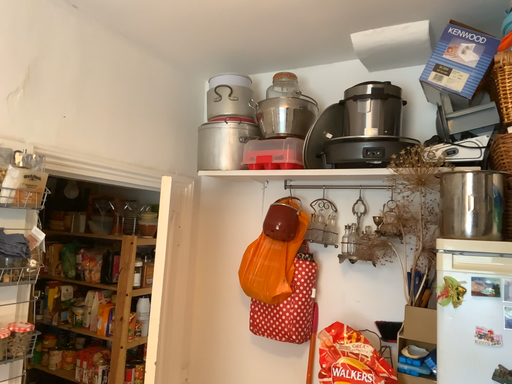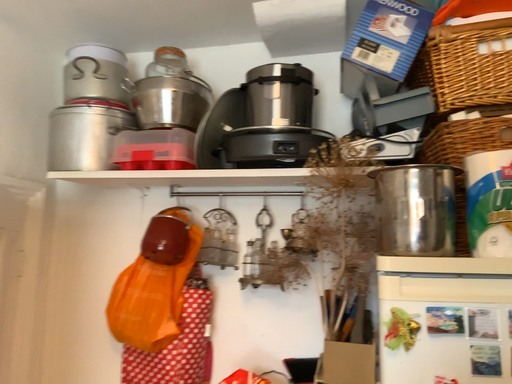
Question: Which way did the camera rotate in the video?

Choices:
 (A) rotated left
 (B) rotated right

Answer: (B)